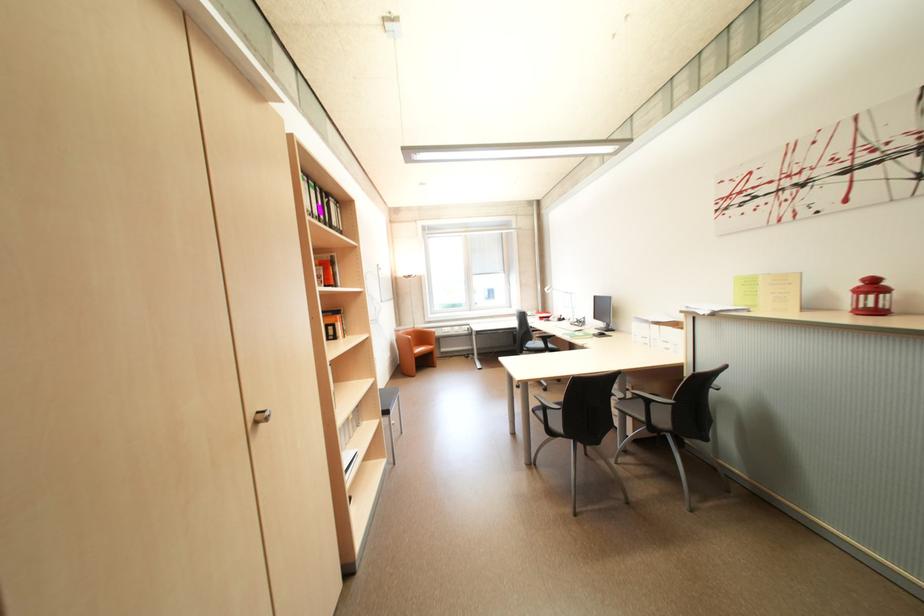
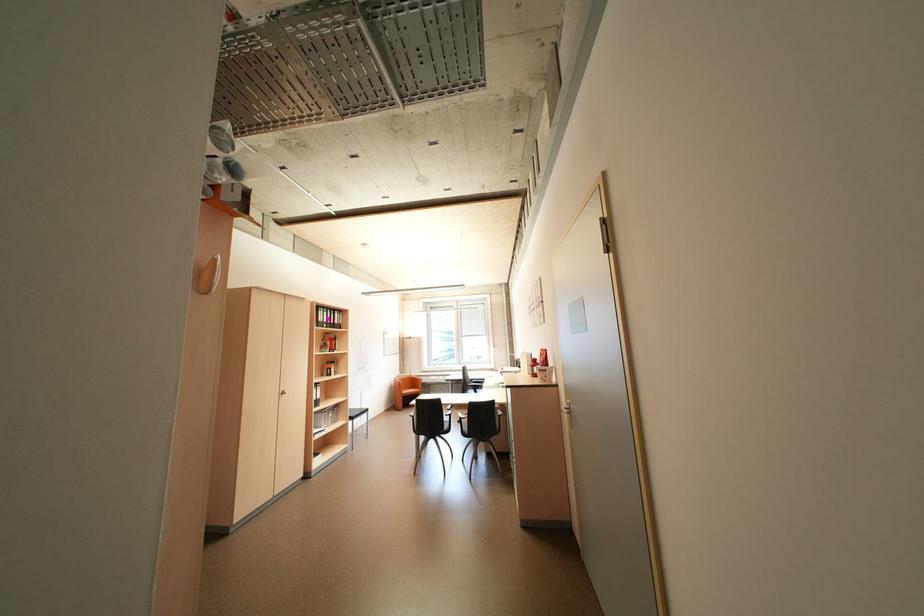
The images are taken continuously from a first-person perspective. In which direction are you moving?

The cameraman moved toward right, backward.